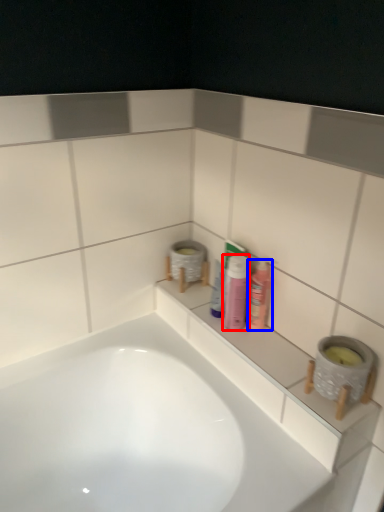
Question: Which object is closer to the camera taking this photo, toiletry (highlighted by a red box) or mouthwash (highlighted by a blue box)?

Choices:
 (A) toiletry
 (B) mouthwash

Answer: (A)